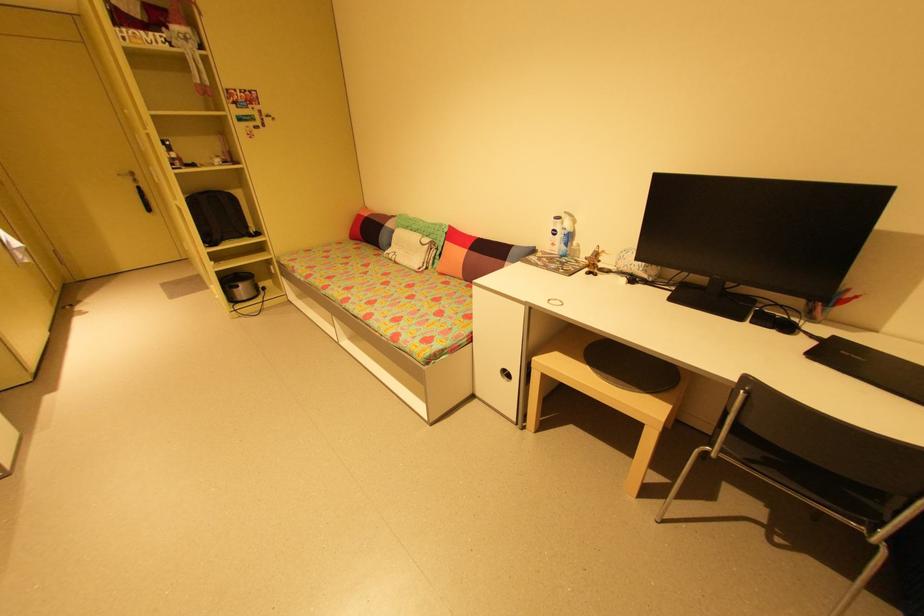
Locate an element on the screen. The width and height of the screenshot is (924, 616). wooden stool surface is located at coordinates (602, 395).